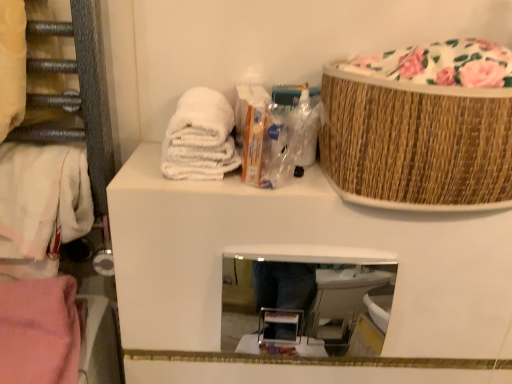
This screenshot has height=384, width=512. What do you see at coordinates (200, 137) in the screenshot?
I see `white towel at upper left, marked as the 2th material in a left-to-right arrangement` at bounding box center [200, 137].

You are a GUI agent. You are given a task and a screenshot of the screen. Output one action in this format:
    pyautogui.click(x=<x>, y=<y>)
    Task: Click on the clear glass mirror at center
    This screenshot has height=384, width=512.
    Given the screenshot: What is the action you would take?
    pyautogui.click(x=301, y=297)

You are a GUI agent. You are given a task and a screenshot of the screen. Output one action in this format:
    pyautogui.click(x=<x>, y=<y>)
    Task: Click on the bamboo textured basket at upper right
    The height and width of the screenshot is (384, 512).
    Given the screenshot: What is the action you would take?
    pyautogui.click(x=416, y=143)

Considering the positions of points (17, 228) and (263, 259), is point (17, 228) farther from camera compared to point (263, 259)?

Yes, it is.

From a real-world perspective, is white cotton towel at left above or below clear glass mirror at center?

Clearly, from a real-world perspective, white cotton towel at left is above clear glass mirror at center.

From the picture: Does white cotton towel at left have a lesser width compared to clear glass mirror at center?

No, white cotton towel at left is not thinner than clear glass mirror at center.

Is white cotton towel at left oriented away from clear glass mirror at center?

white cotton towel at left does not have its back to clear glass mirror at center.

Who is more distant, floral fabric basket at upper right or bamboo textured basket at upper right?

Positioned behind is floral fabric basket at upper right.

Can you confirm if floral fabric basket at upper right is shorter than bamboo textured basket at upper right?

Yes, floral fabric basket at upper right is shorter than bamboo textured basket at upper right.

Which object is thinner, floral fabric basket at upper right or bamboo textured basket at upper right?

bamboo textured basket at upper right is thinner.

In terms of size, does floral fabric basket at upper right appear bigger or smaller than white cotton towel at left?

In the image, floral fabric basket at upper right appears to be larger than white cotton towel at left.

Can you tell me how much floral fabric basket at upper right and white cotton towel at left differ in facing direction?

The angular difference between floral fabric basket at upper right and white cotton towel at left is 2.26 degrees.

Between floral fabric basket at upper right and white cotton towel at left, which one appears on the left side from the viewer's perspective?

Positioned to the left is white cotton towel at left.

Which is farther, (492, 86) or (25, 249)?

Point (25, 249)

In the image, is white cotton towel at left on the left side or the right side of white towel at upper left, the 1th material positioned from the right?

Clearly, white cotton towel at left is on the left of white towel at upper left, the 1th material positioned from the right, in the image.

Is white cotton towel at left not close to white towel at upper left, which is counted as the 1th material, starting from the top?

They are positioned close to each other.

Is white towel at upper left, the 2th material when ordered from bottom to top, located within white cotton towel at left?

No, white towel at upper left, the 2th material when ordered from bottom to top, is not surrounded by white cotton towel at left.

Considering the sizes of objects bamboo textured basket at upper right and clear glass mirror at center in the image provided, who is smaller, bamboo textured basket at upper right or clear glass mirror at center?

Smaller between the two is clear glass mirror at center.

How different are the orientations of bamboo textured basket at upper right and clear glass mirror at center in degrees?

bamboo textured basket at upper right and clear glass mirror at center are facing 0.321 degrees away from each other.

Is bamboo textured basket at upper right next to clear glass mirror at center and touching it?

No, bamboo textured basket at upper right is not making contact with clear glass mirror at center.

Does bamboo textured basket at upper right have a greater height compared to clear glass mirror at center?

Yes.

Does bamboo textured basket at upper right have a lesser width compared to floral fabric basket at upper right?

Correct, the width of bamboo textured basket at upper right is less than that of floral fabric basket at upper right.

From the image's perspective, is bamboo textured basket at upper right above or below floral fabric basket at upper right?

From the image's perspective, bamboo textured basket at upper right appears below floral fabric basket at upper right.

Considering the relative sizes of bamboo textured basket at upper right and floral fabric basket at upper right in the image provided, is bamboo textured basket at upper right shorter than floral fabric basket at upper right?

Incorrect, the height of bamboo textured basket at upper right does not fall short of that of floral fabric basket at upper right.

Considering the sizes of objects bamboo textured basket at upper right and floral fabric basket at upper right in the image provided, who is smaller, bamboo textured basket at upper right or floral fabric basket at upper right?

Smaller between the two is floral fabric basket at upper right.

In the scene shown: Is bamboo textured basket at upper right located within pink fabric towel at lower left, arranged as the 1th material when ordered from the bottom?

No, bamboo textured basket at upper right is not surrounded by pink fabric towel at lower left, arranged as the 1th material when ordered from the bottom.

Is pink fabric towel at lower left, positioned as the 2th material in right-to-left order, closer to the viewer compared to bamboo textured basket at upper right?

No, the depth of pink fabric towel at lower left, positioned as the 2th material in right-to-left order, is greater than that of bamboo textured basket at upper right.

Considering the sizes of objects pink fabric towel at lower left, positioned as the 2th material in right-to-left order, and bamboo textured basket at upper right in the image provided, who is thinner, pink fabric towel at lower left, positioned as the 2th material in right-to-left order, or bamboo textured basket at upper right?

bamboo textured basket at upper right.

Is pink fabric towel at lower left, positioned as the 2th material in right-to-left order, shorter than bamboo textured basket at upper right?

Yes, pink fabric towel at lower left, positioned as the 2th material in right-to-left order, is shorter than bamboo textured basket at upper right.

What are the coordinates of `clothing above the clear glass mirror at center (from the image's perspective)` in the screenshot? It's located at (41, 206).

This screenshot has height=384, width=512. Find the location of `food on the right of bamboo textured basket at upper right`. food on the right of bamboo textured basket at upper right is located at coordinates (441, 64).

Based on their spatial positions, is white towel at upper left, the 1th material positioned from the right, or floral fabric basket at upper right further from white cotton towel at left?

floral fabric basket at upper right lies further to white cotton towel at left than the other object.

Looking at the image, which one is located closer to white cotton towel at left, floral fabric basket at upper right or bamboo textured basket at upper right?

The object closer to white cotton towel at left is bamboo textured basket at upper right.

When comparing their distances from white towel at upper left, the 2th material when ordered from bottom to top, does pink fabric towel at lower left, arranged as the second material when viewed from the top, or bamboo textured basket at upper right seem closer?

bamboo textured basket at upper right.

From the picture: Which object lies nearer to the anchor point white cotton towel at left, bamboo textured basket at upper right or white towel at upper left, marked as the 2th material in a left-to-right arrangement?

white towel at upper left, marked as the 2th material in a left-to-right arrangement.

When comparing their distances from bamboo textured basket at upper right, does white towel at upper left, the 1th material positioned from the right, or floral fabric basket at upper right seem closer?

floral fabric basket at upper right lies closer to bamboo textured basket at upper right than the other object.

Looking at the image, which one is located closer to white towel at upper left, the 2th material when ordered from bottom to top, white cotton towel at left or pink fabric towel at lower left, arranged as the 1th material when ordered from the bottom?

white cotton towel at left lies closer to white towel at upper left, the 2th material when ordered from bottom to top, than the other object.

Looking at the image, which one is located further to bamboo textured basket at upper right, white towel at upper left, marked as the 2th material in a left-to-right arrangement, or clear glass mirror at center?

The object further to bamboo textured basket at upper right is clear glass mirror at center.

When comparing their distances from pink fabric towel at lower left, positioned as the 2th material in right-to-left order, does white towel at upper left, which is counted as the 1th material, starting from the top, or bamboo textured basket at upper right seem further?

The object further to pink fabric towel at lower left, positioned as the 2th material in right-to-left order, is bamboo textured basket at upper right.

You are a GUI agent. You are given a task and a screenshot of the screen. Output one action in this format:
    pyautogui.click(x=<x>, y=<y>)
    Task: Click on the material that lies between floral fabric basket at upper right and clear glass mirror at center from top to bottom
    The height and width of the screenshot is (384, 512).
    Given the screenshot: What is the action you would take?
    pyautogui.click(x=200, y=137)

Where is `basket situated between white towel at upper left, the 1th material positioned from the right, and floral fabric basket at upper right from left to right`? This screenshot has height=384, width=512. basket situated between white towel at upper left, the 1th material positioned from the right, and floral fabric basket at upper right from left to right is located at coordinates (416, 143).

Identify the location of mirror between pink fabric towel at lower left, arranged as the 1th material when ordered from the bottom, and floral fabric basket at upper right from left to right. This screenshot has height=384, width=512. (301, 297).

I want to click on mirror between white towel at upper left, the 1th material positioned from the right, and bamboo textured basket at upper right, in the horizontal direction, so click(301, 297).